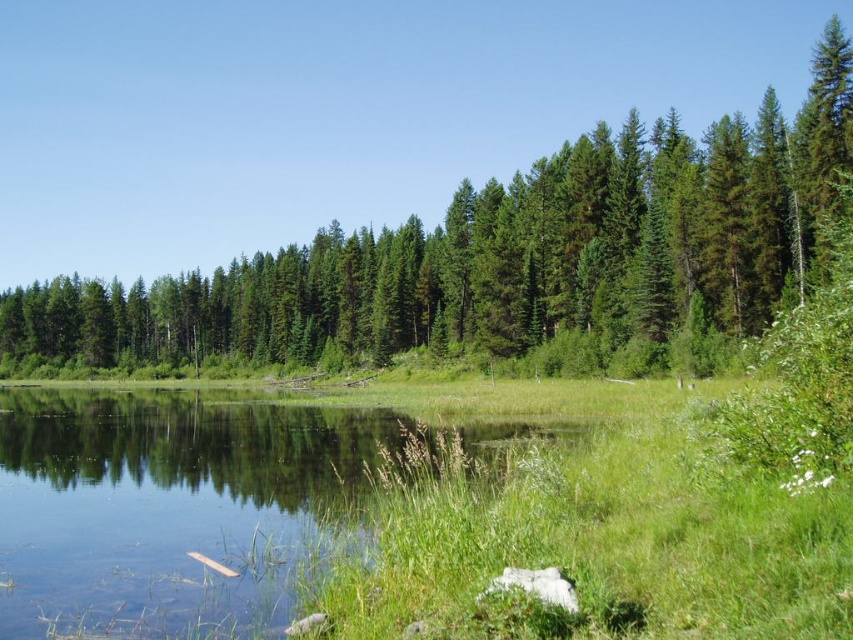
You are standing at the point marked as point (x=502, y=253) in the image. What do you see directly in front of you?

At point (x=502, y=253) lies green matte trees at center, so you would see green matte trees at center directly in front of you.

You are standing at the edge of the green grassy lake at center and want to walk towards the green matte trees at center. Which direction should you head?

You should head to the left because the green matte trees at center are located to the left of the green grassy lake at center according to the description.

You are standing at the edge of the water in the scene and want to estimate how far the green matte trees at center are from your current position. Based on the information provided, what is the approximate distance?

The green matte trees at center are approximately 38.24 meters away from the viewer.